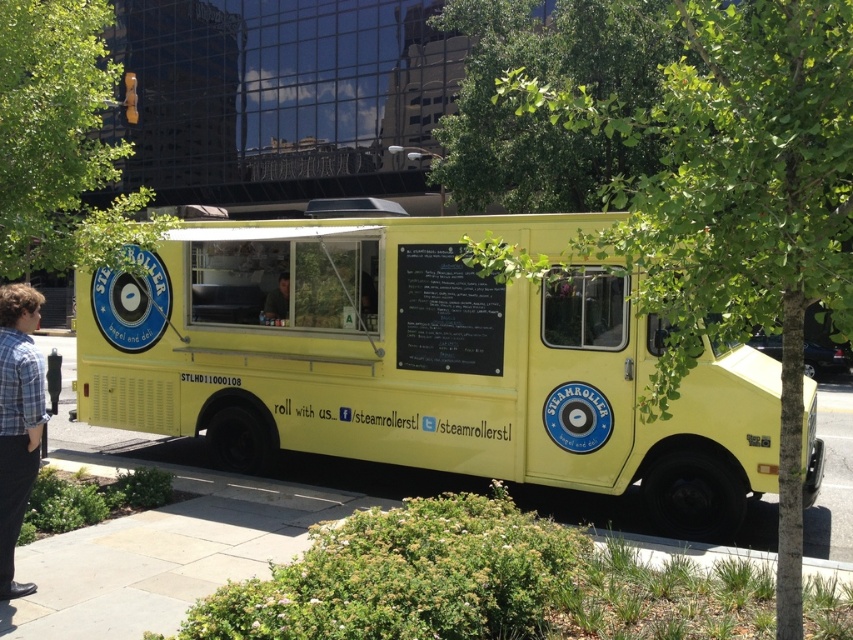
You are standing in front of the food truck and want to take a photo of the black chalkboard at center. If your camera is 7.11 meters away from the chalkboard, will it be in focus?

The black chalkboard at center and camera are 7.11 meters apart from each other, so the camera should be able to focus on the chalkboard at that distance.

Based on the photo, you are a customer waiting in line at the food truck and see the green leafy tree at center and the plaid shirt at left. Which object is positioned higher from the ground?

The green leafy tree at center is above the plaid shirt at left, so the green leafy tree at center is positioned higher from the ground.